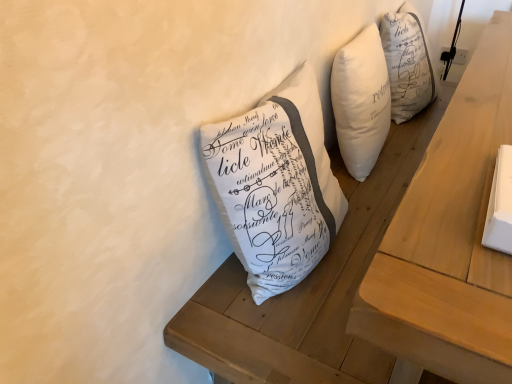
Question: Considering the positions of wooden table at center and white fabric pillow at center in the image, is wooden table at center taller or shorter than white fabric pillow at center?

Choices:
 (A) tall
 (B) short

Answer: (B)

Question: From the image's perspective, relative to white fabric pillow at center, is wooden table at center above or below?

Choices:
 (A) below
 (B) above

Answer: (B)

Question: From a real-world perspective, relative to white fabric pillow at center, is wooden table at center vertically above or below?

Choices:
 (A) below
 (B) above

Answer: (A)

Question: Considering the positions of white fabric pillow at center and wooden table at center in the image, is white fabric pillow at center bigger or smaller than wooden table at center?

Choices:
 (A) small
 (B) big

Answer: (A)

Question: Based on their positions, is white fabric pillow at center located to the left or right of wooden table at center?

Choices:
 (A) left
 (B) right

Answer: (A)

Question: In terms of width, does white fabric pillow at center look wider or thinner when compared to wooden table at center?

Choices:
 (A) thin
 (B) wide

Answer: (B)

Question: From the image's perspective, is white fabric pillow at center located above or below wooden table at center?

Choices:
 (A) above
 (B) below

Answer: (B)